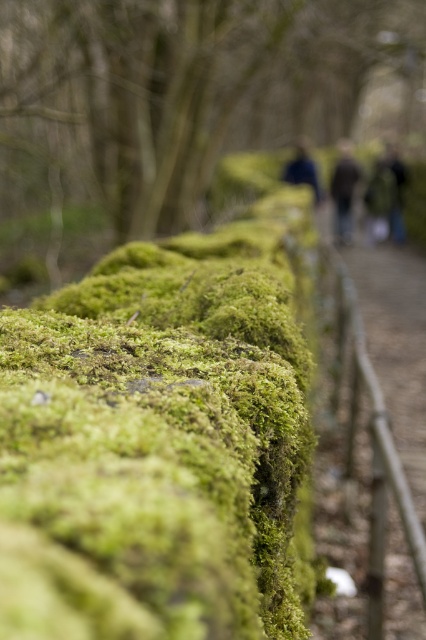
You are standing in a garden and see the green mossy wall at center and the dark green textured jacket at upper center. Which object is located to the left of the other?

The green mossy wall at center is positioned on the left side of dark green textured jacket at upper center.

You are standing in front of the mossy stone wall and notice two points marked on the wall. The first point is at coordinates point (379, 208) and the second is at point (339, 237). Which point is closer to you?

Point (379, 208) is closer to the viewer than point (339, 237).

You are standing in front of the mossy wall and want to place your dark green textured jacket at upper center on the ground next to the green mossy wall at center. Considering their widths, will the jacket fit next to the wall without overlapping?

The green mossy wall at center is wider than the dark green textured jacket at upper center. Since the wall is wider, there should be enough space to place the jacket next to it without overlapping.